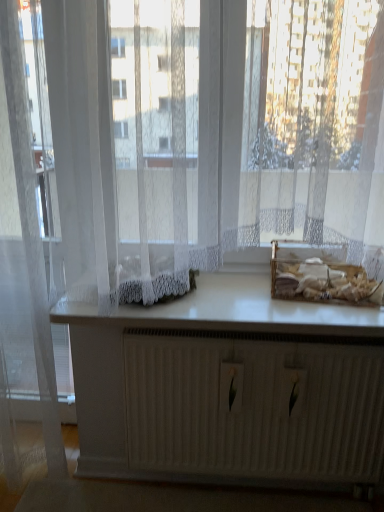
Question: Does white smooth countertop at center have a smaller size compared to translucent white curtain at left?

Choices:
 (A) yes
 (B) no

Answer: (A)

Question: Is the depth of white smooth countertop at center greater than that of translucent white curtain at left?

Choices:
 (A) yes
 (B) no

Answer: (A)

Question: Does white smooth countertop at center have a lesser width compared to translucent white curtain at left?

Choices:
 (A) yes
 (B) no

Answer: (B)

Question: From the image's perspective, is white smooth countertop at center beneath translucent white curtain at left?

Choices:
 (A) yes
 (B) no

Answer: (A)

Question: From a real-world perspective, is white smooth countertop at center physically above translucent white curtain at left?

Choices:
 (A) yes
 (B) no

Answer: (B)

Question: Does white smooth countertop at center appear on the right side of translucent white curtain at left?

Choices:
 (A) no
 (B) yes

Answer: (B)

Question: Is translucent white curtain at left turned away from white lace curtains at center?

Choices:
 (A) yes
 (B) no

Answer: (B)

Question: From a real-world perspective, is translucent white curtain at left beneath white lace curtains at center?

Choices:
 (A) no
 (B) yes

Answer: (B)

Question: Is white lace curtains at center inside translucent white curtain at left?

Choices:
 (A) yes
 (B) no

Answer: (B)

Question: Is translucent white curtain at left smaller than white lace curtains at center?

Choices:
 (A) yes
 (B) no

Answer: (A)

Question: From a real-world perspective, is translucent white curtain at left positioned over white lace curtains at center based on gravity?

Choices:
 (A) no
 (B) yes

Answer: (A)

Question: Can you confirm if translucent white curtain at left is thinner than white lace curtains at center?

Choices:
 (A) no
 (B) yes

Answer: (B)

Question: Considering the relative sizes of translucent white curtain at left and white smooth countertop at center in the image provided, is translucent white curtain at left shorter than white smooth countertop at center?

Choices:
 (A) no
 (B) yes

Answer: (A)